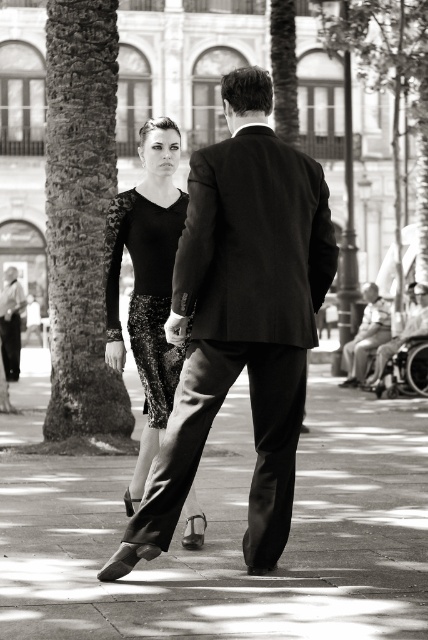
Question: Which of the following is the closest to the observer?

Choices:
 (A) (314, 182)
 (B) (180, 195)
 (C) (225, 410)

Answer: (A)

Question: Can you confirm if sequined fabric dress at center is positioned above matte black suit at center?

Choices:
 (A) yes
 (B) no

Answer: (A)

Question: Among these objects, which one is farthest from the camera?

Choices:
 (A) sparkly black dress at center
 (B) matte black suit at center
 (C) sequined fabric dress at center
 (D) smooth concrete pavement at center

Answer: (B)

Question: Based on their relative distances, which object is farther from the matte black suit at center?

Choices:
 (A) smooth black suit at center
 (B) light beige suit at right

Answer: (A)

Question: Does sparkly black dress at center have a lesser width compared to light beige suit at right?

Choices:
 (A) yes
 (B) no

Answer: (B)

Question: In this image, where is sparkly black dress at center located relative to light beige suit at right?

Choices:
 (A) right
 (B) left

Answer: (B)